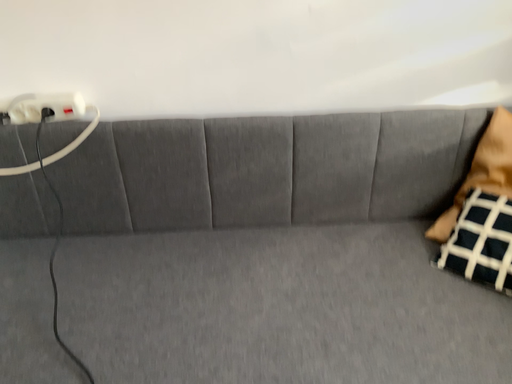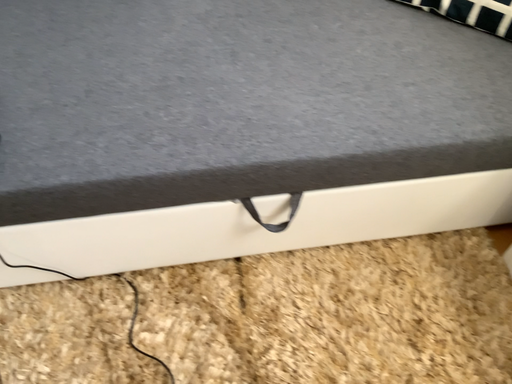
Question: Which way did the camera rotate in the video?

Choices:
 (A) rotated downward
 (B) rotated upward

Answer: (A)